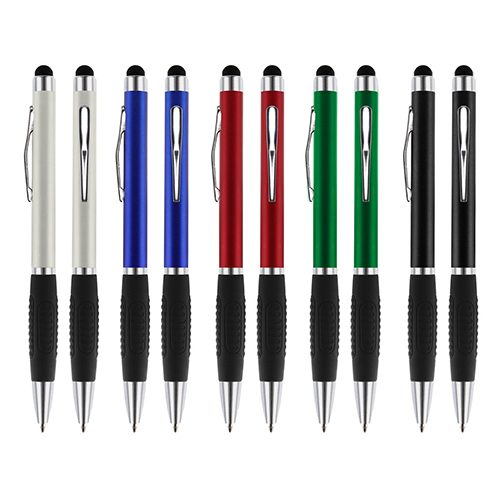
I want to click on black or white pens, so click(472, 196), click(416, 221), click(91, 246), click(43, 208).